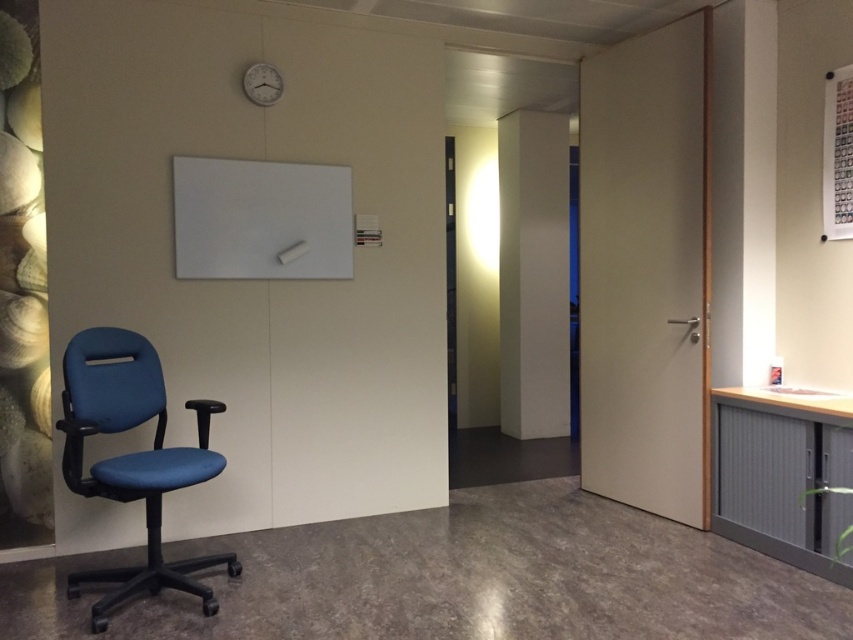
Question: Estimate the real-world distances between objects in this image. Which object is farther from the blue fabric swivel chair at left?

Choices:
 (A) metallic silver clock at upper center
 (B) white matte whiteboard at upper center

Answer: (A)

Question: Is blue fabric swivel chair at left closer to the viewer compared to metallic silver clock at upper center?

Choices:
 (A) no
 (B) yes

Answer: (B)

Question: Which of the following is the closest to the observer?

Choices:
 (A) white matte whiteboard at upper center
 (B) metallic silver clock at upper center

Answer: (A)

Question: Observing the image, what is the correct spatial positioning of blue fabric swivel chair at left in reference to white matte whiteboard at upper center?

Choices:
 (A) left
 (B) right

Answer: (A)

Question: Which point is farther to the camera?

Choices:
 (A) (187, 204)
 (B) (202, 413)

Answer: (A)

Question: Is white matte whiteboard at upper center further to the viewer compared to metallic silver clock at upper center?

Choices:
 (A) no
 (B) yes

Answer: (A)